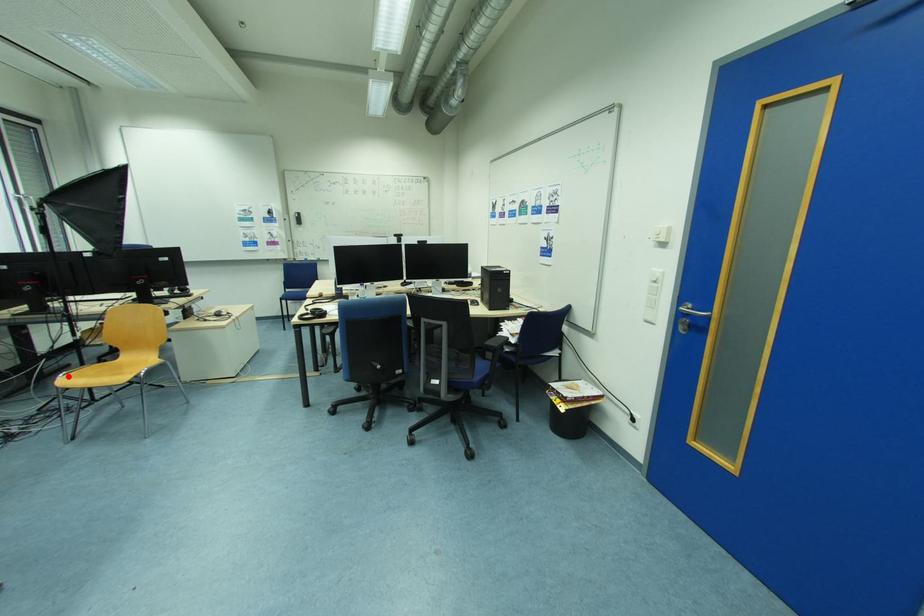
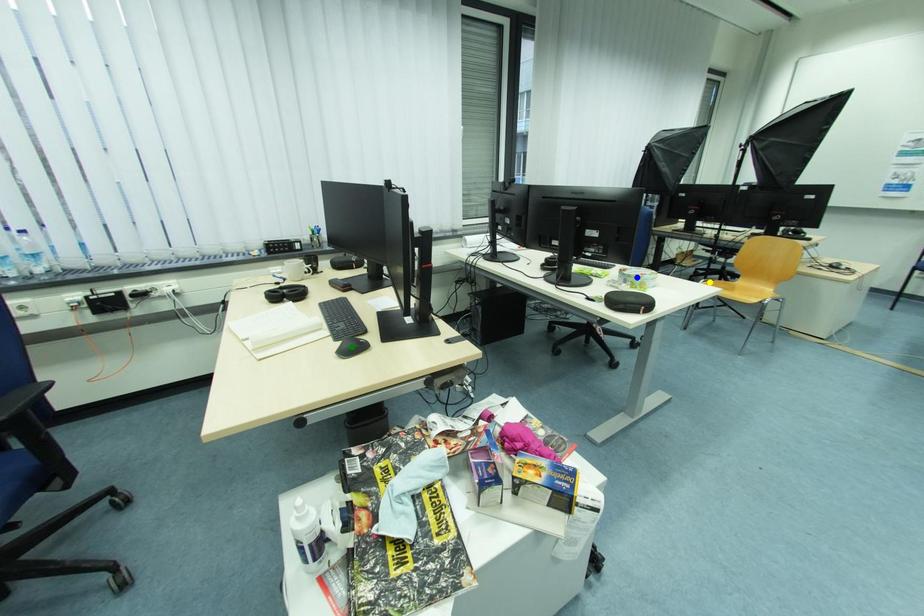
Question: I am providing you with two images of the same scene from different viewpoints. A red point is marked on the first image. You are given multiple points on the second image. Which spot in image 2 lines up with the point in image 1?

Choices:
 (A) green point
 (B) blue point
 (C) yellow point

Answer: (C)